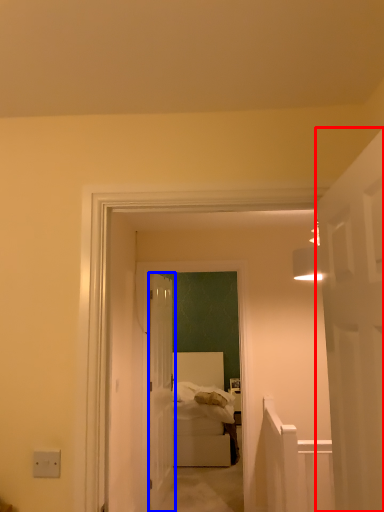
Question: Which object appears closest to the camera in this image, door (highlighted by a red box) or door (highlighted by a blue box)?

Choices:
 (A) door
 (B) door

Answer: (A)